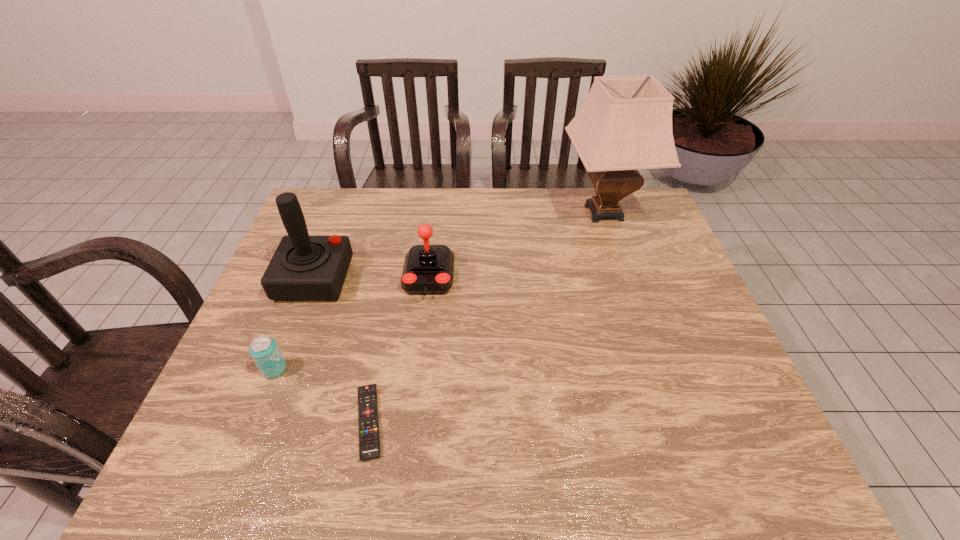
This screenshot has width=960, height=540. In order to click on blank region between the tallest object and the shorter joystick in this screenshot , I will do `click(516, 245)`.

Locate an element on the screen. This screenshot has width=960, height=540. free space between the fourth farthest object and the third shortest object is located at coordinates (351, 323).

Where is `empty location between the second nearest object and the right joystick`? This screenshot has height=540, width=960. empty location between the second nearest object and the right joystick is located at coordinates (351, 323).

Identify the location of free spot between the right joystick and the lampshade. (516, 245).

Where is `blank region between the lampshade and the third shortest object`? This screenshot has width=960, height=540. blank region between the lampshade and the third shortest object is located at coordinates (516, 245).

I want to click on free space between the left joystick and the shortest object, so click(342, 350).

Identify the location of unoccupied position between the taller joystick and the beer can. (295, 324).

I want to click on object that is the second closest to the third shortest object, so click(x=369, y=439).

Locate which object is the second closest to the taller joystick. Please provide its 2D coordinates. Your answer should be formatted as a tuple, i.e. [(x, y)], where the tuple contains the x and y coordinates of a point satisfying the conditions above.

[(263, 349)]

Where is `free region that satisfies the following two spatial constraints: 1. on the base of the right joystick; 2. on the base of the second tallest object`? The image size is (960, 540). free region that satisfies the following two spatial constraints: 1. on the base of the right joystick; 2. on the base of the second tallest object is located at coordinates (429, 279).